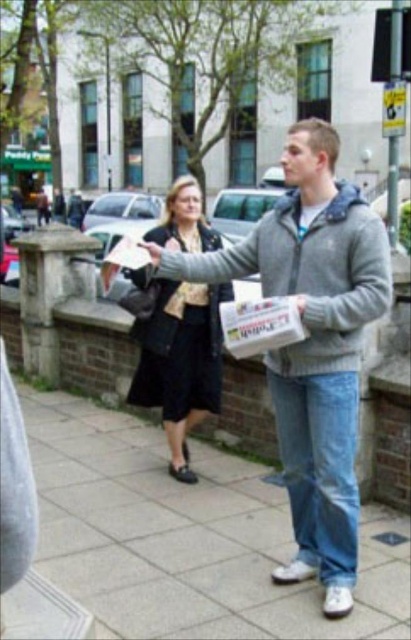
Does point (321, 483) come farther from viewer compared to point (240, 252)?

No.

Where is `gray fleece jacket at center`? The width and height of the screenshot is (411, 640). gray fleece jacket at center is located at coordinates (355, 284).

Identify the location of gray fleece jacket at center. Image resolution: width=411 pixels, height=640 pixels. (355, 284).

Between gray concrete pavement at center and gray fleece sweatshirt at center, which one is positioned higher?

gray fleece sweatshirt at center

The width and height of the screenshot is (411, 640). I want to click on gray concrete pavement at center, so click(187, 536).

You are a GUI agent. You are given a task and a screenshot of the screen. Output one action in this format:
    pyautogui.click(x=<x>, y=<y>)
    Task: Click on the gray concrete pavement at center
    The height and width of the screenshot is (640, 411).
    Given the screenshot: What is the action you would take?
    pyautogui.click(x=187, y=536)

Between matte black jacket at center and matte plastic bag at lower left, which one has more height?

Standing taller between the two is matte black jacket at center.

Is point (196, 372) positioned before point (0, 516)?

No, (196, 372) is behind (0, 516).

Where is `matte black jacket at center`? The image size is (411, 640). matte black jacket at center is located at coordinates (180, 362).